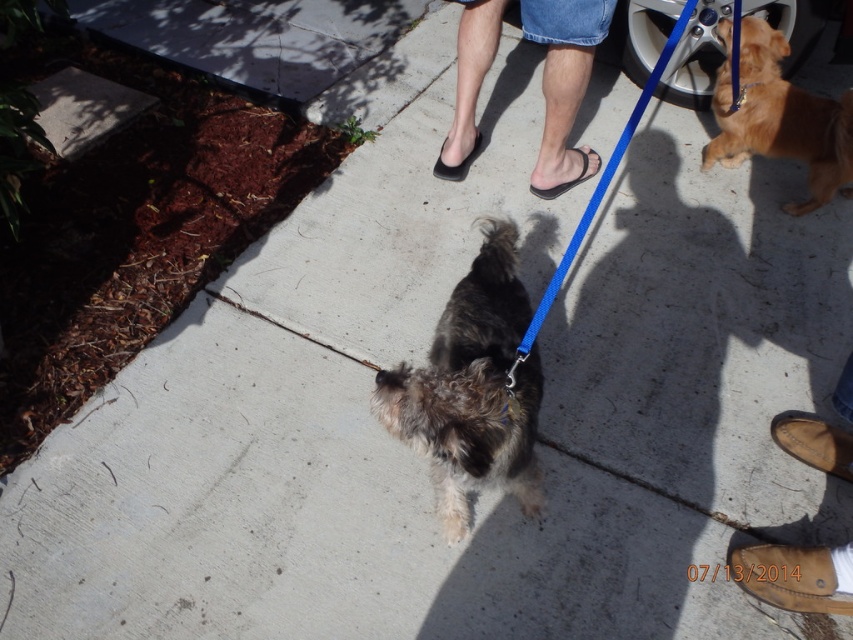
You are a photographer trying to capture a photo of the golden fur dog at right and the brown leather sandal at lower right. Which object should you focus on first if you want to include both in the frame without moving the camera?

The golden fur dog at right is larger in size than the brown leather sandal at lower right, so you should focus on the golden fur dog at right first to ensure it fits properly in the frame.